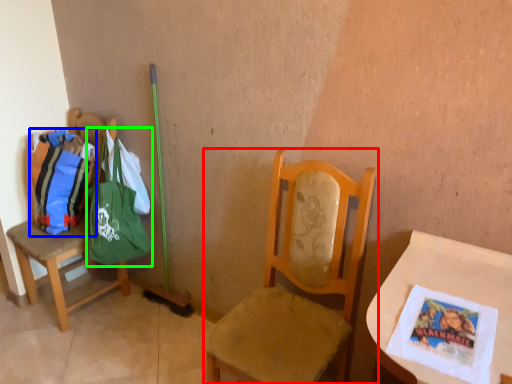
Question: Which object is the farthest from chair (highlighted by a red box)? Choose among these: grocery bag (highlighted by a blue box) or shoulder bag (highlighted by a green box).

Choices:
 (A) grocery bag
 (B) shoulder bag

Answer: (A)